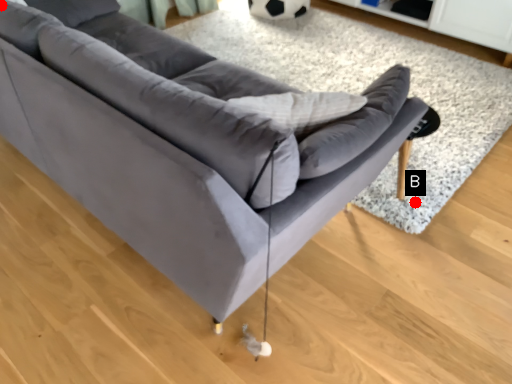
Question: Two points are circled on the image, labeled by A and B beside each circle. Which point appears closest to the camera in this image?

Choices:
 (A) A is closer
 (B) B is closer

Answer: (A)